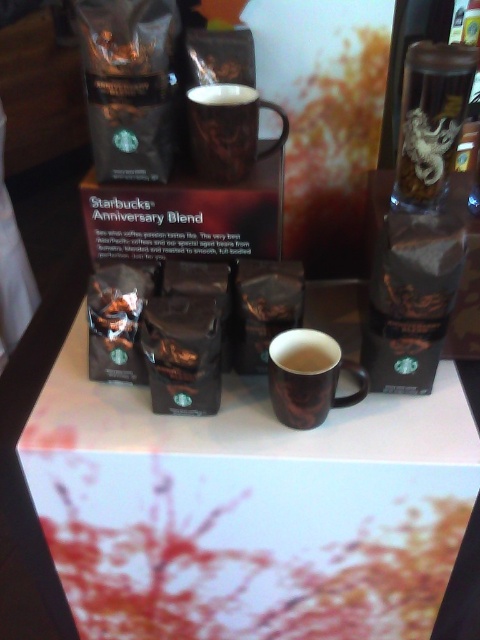
You are a barista arranging items on the table. You need to place a new Starbucks Anniversary Blend bag between the transparent glass at upper right and the brown glossy mug at upper center. Based on their positions, which item should the bag be closer to?

The transparent glass at upper right is closer to the viewer than the brown glossy mug at upper center, so the Starbucks Anniversary Blend bag should be placed closer to the transparent glass at upper right to maintain the spatial arrangement.